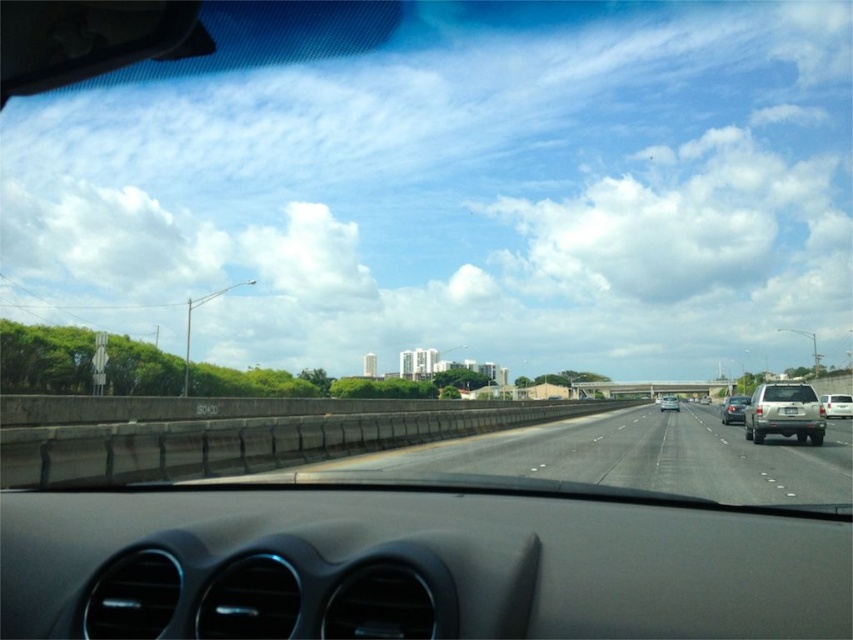
Question: Which point appears farthest from the camera in this image?

Choices:
 (A) (727, 410)
 (B) (849, 406)

Answer: (B)

Question: Among these points, which one is nearest to the camera?

Choices:
 (A) (495, 460)
 (B) (544, 506)
 (C) (672, 394)
 (D) (758, 433)

Answer: (B)

Question: Is matte gray dashboard at center further to the viewer compared to gray asphalt highway at center?

Choices:
 (A) yes
 (B) no

Answer: (B)

Question: Can you confirm if satin gold suv at right is bigger than silver metallic suv at right?

Choices:
 (A) no
 (B) yes

Answer: (A)

Question: Does matte gray dashboard at center lie in front of satin gold suv at right?

Choices:
 (A) yes
 (B) no

Answer: (A)

Question: Which point is closer to the camera taking this photo?

Choices:
 (A) (666, 401)
 (B) (734, 420)

Answer: (B)